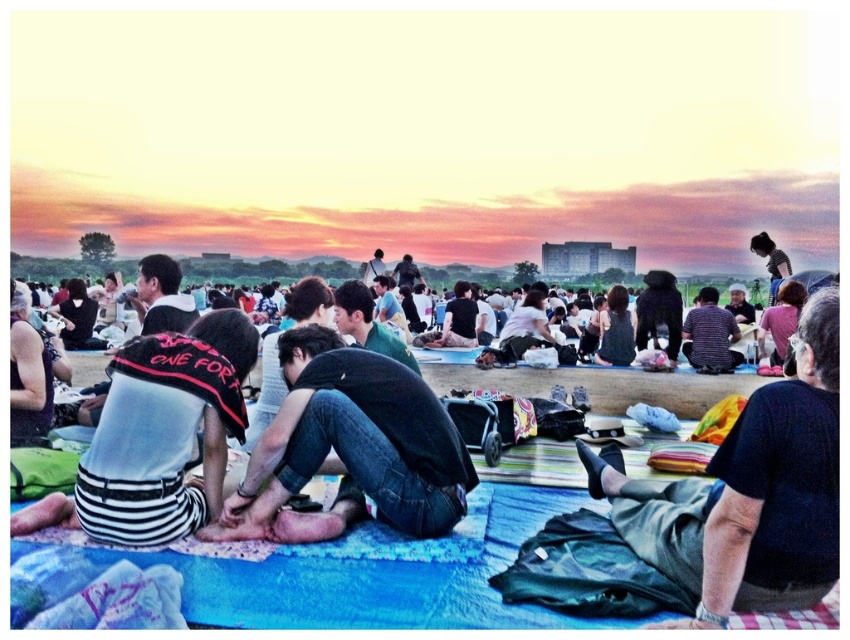
Question: Does dark gray pants at center appear over denim jeans at center?

Choices:
 (A) yes
 (B) no

Answer: (A)

Question: Which object appears closest to the camera in this image?

Choices:
 (A) dark gray pants at center
 (B) black striped shirt at center

Answer: (A)

Question: Does dark gray pants at center appear under denim jeans at center?

Choices:
 (A) no
 (B) yes

Answer: (A)

Question: Which point appears farthest from the camera in this image?

Choices:
 (A) tap(667, 493)
 (B) tap(95, 440)

Answer: (A)

Question: Does denim jeans at center have a smaller size compared to black striped shirt at center?

Choices:
 (A) no
 (B) yes

Answer: (A)

Question: Which point is farther to the camera?

Choices:
 (A) (375, 387)
 (B) (123, 419)

Answer: (A)